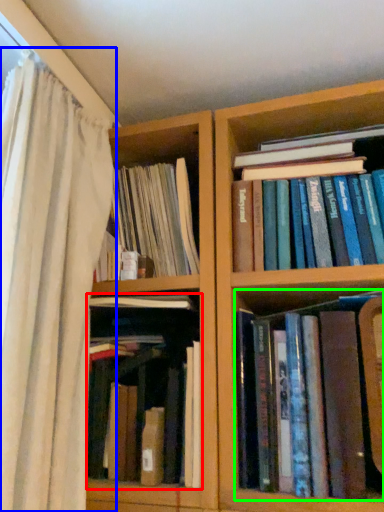
Question: Which object is the closest to the book (highlighted by a red box)? Choose among these: curtain (highlighted by a blue box) or book (highlighted by a green box).

Choices:
 (A) curtain
 (B) book

Answer: (A)